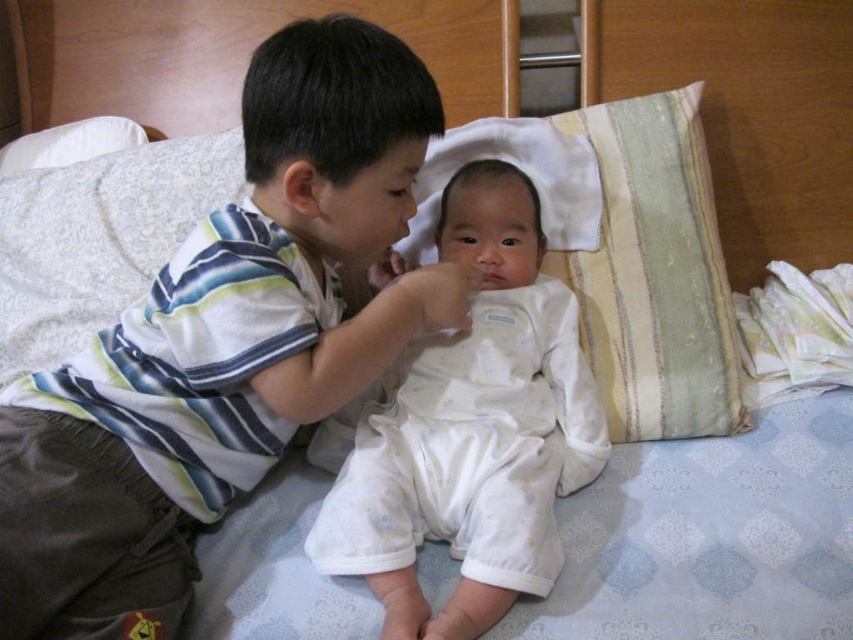
You are a parent trying to put away laundry. You see the striped cotton shirt at center and the green striped pillow at upper right on the bed. Which item should you pick up first if you want to place them into the laundry basket without moving any other items?

You should pick up the green striped pillow at upper right first because the striped cotton shirt at center is in front of it, making the pillow harder to reach without moving the shirt.

You are a parent trying to arrange pillows on the bed for a photo shoot. You have the white textured pillow at upper center and the green striped pillow at upper right. Which pillow should you place at the center of the bed to ensure it stands out more due to its size?

The white textured pillow at upper center is larger in size than the green striped pillow at upper right, so you should place the white textured pillow at upper center at the center of the bed to ensure it stands out more due to its size.

You are standing 1 meter away from the bed. There is a point at coordinates point (221, 160). Can you reach this point without moving closer to the bed?

The distance of point (221, 160) from viewer is 1.17 meters, so you are currently 1 meter away from the bed. Since 1.17 meters is farther than your current distance, you cannot reach the point without moving closer to the bed.